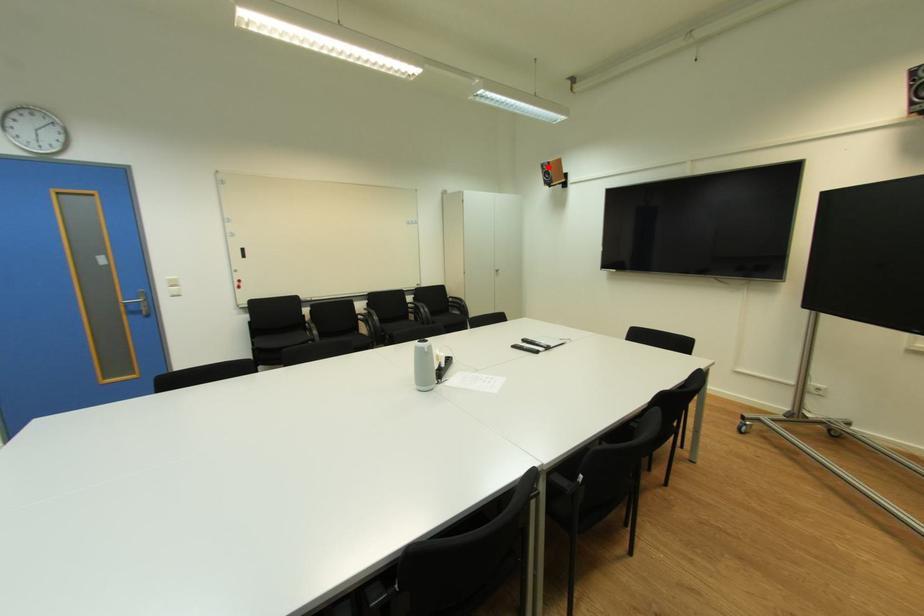
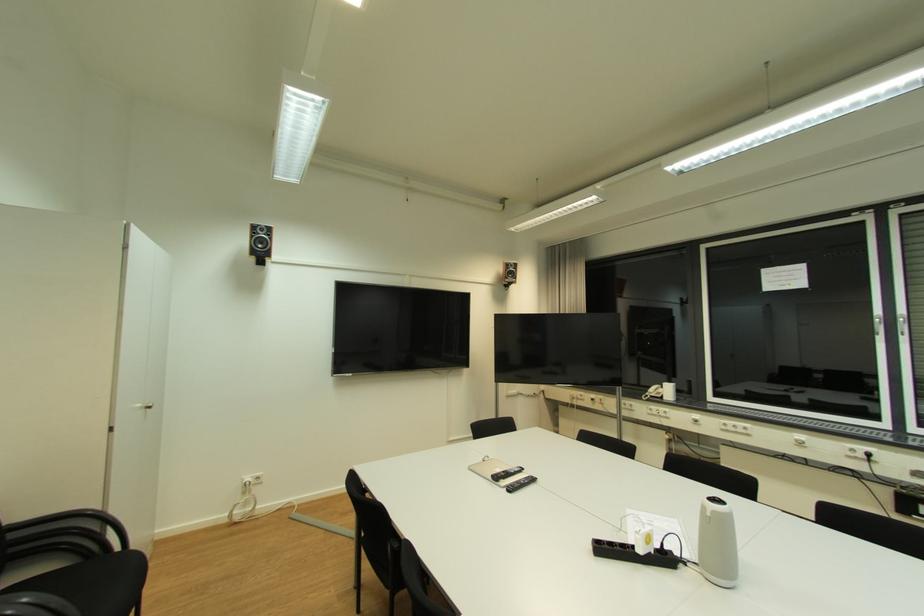
The point at the highlighted location is marked in the first image. Where is the corresponding point in the second image?

(261, 228)